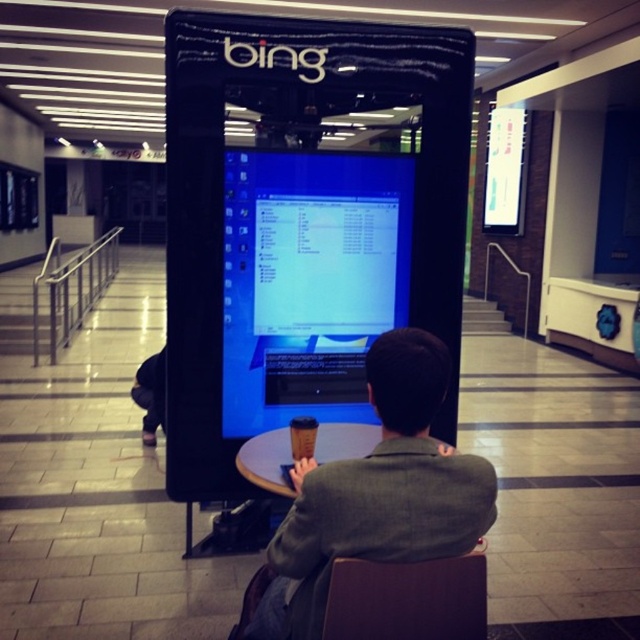
From the picture: Can you confirm if blue glossy monitor at center is taller than brown leather chair at lower center?

Indeed, blue glossy monitor at center has a greater height compared to brown leather chair at lower center.

You are a GUI agent. You are given a task and a screenshot of the screen. Output one action in this format:
    pyautogui.click(x=<x>, y=<y>)
    Task: Click on the blue glossy monitor at center
    
    Given the screenshot: What is the action you would take?
    pyautogui.click(x=308, y=280)

Can you confirm if blue glossy monitor at center is taller than dark gray suit at center?

Indeed, blue glossy monitor at center has a greater height compared to dark gray suit at center.

Is blue glossy monitor at center closer to camera compared to dark gray suit at center?

No, blue glossy monitor at center is further to the viewer.

Describe the element at coordinates (308, 280) in the screenshot. I see `blue glossy monitor at center` at that location.

Find the location of a particular element. The height and width of the screenshot is (640, 640). blue glossy monitor at center is located at coordinates pyautogui.click(x=308, y=280).

Can you confirm if dark gray suit at center is shorter than brown leather chair at lower center?

No.

This screenshot has height=640, width=640. I want to click on dark gray suit at center, so click(x=378, y=492).